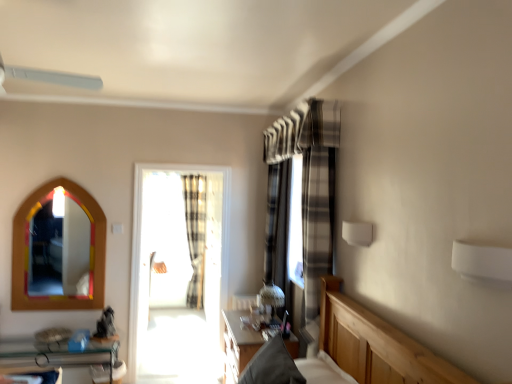
Where is `plaid fabric curtain at center, acting as the 1th curtain starting from the front`? This screenshot has width=512, height=384. plaid fabric curtain at center, acting as the 1th curtain starting from the front is located at coordinates (318, 195).

The height and width of the screenshot is (384, 512). What are the coordinates of `translucent glass window at center` in the screenshot? It's located at (175, 248).

What is the approximate width of translucent glass window at center?

The width of translucent glass window at center is 7.14 inches.

What do you see at coordinates (238, 345) in the screenshot? I see `wooden table at center` at bounding box center [238, 345].

You are a GUI agent. You are given a task and a screenshot of the screen. Output one action in this format:
    pyautogui.click(x=<x>, y=<y>)
    Task: Click on the wooden table at center
    The image size is (512, 384).
    Given the screenshot: What is the action you would take?
    pyautogui.click(x=238, y=345)

You are a GUI agent. You are given a task and a screenshot of the screen. Output one action in this format:
    pyautogui.click(x=<x>, y=<y>)
    Task: Click on the clear glass shelf at lower left
    
    Given the screenshot: What is the action you would take?
    pyautogui.click(x=55, y=353)

Could you tell me if white plastic fan at upper left is facing multicolored wooden mirror at left?

No, white plastic fan at upper left does not turn towards multicolored wooden mirror at left.

Is multicolored wooden mirror at left inside white plastic fan at upper left?

That's incorrect, multicolored wooden mirror at left is not inside white plastic fan at upper left.

Considering the sizes of objects white plastic fan at upper left and multicolored wooden mirror at left in the image provided, who is taller, white plastic fan at upper left or multicolored wooden mirror at left?

With more height is multicolored wooden mirror at left.

Which of these two, wooden table at center or plaid fabric curtain at center, the first curtain in the right-to-left sequence, is smaller?

wooden table at center.

Is wooden table at center to the left or to the right of plaid fabric curtain at center, which is counted as the 2th curtain, starting from the back, in the image?

From the image, it's evident that wooden table at center is to the left of plaid fabric curtain at center, which is counted as the 2th curtain, starting from the back.

Is wooden table at center positioned far away from plaid fabric curtain at center, which is counted as the second curtain, starting from the left?

No.

Is wooden table at center closer to the viewer compared to plaid fabric curtain at center, which is counted as the 2th curtain, starting from the back?

Yes, it is in front of plaid fabric curtain at center, which is counted as the 2th curtain, starting from the back.

Considering the sizes of objects translucent glass window at center and clear glass shelf at lower left in the image provided, who is thinner, translucent glass window at center or clear glass shelf at lower left?

With smaller width is translucent glass window at center.

Can clear glass shelf at lower left be found inside translucent glass window at center?

That's incorrect, clear glass shelf at lower left is not inside translucent glass window at center.

Consider the image. Does translucent glass window at center lie in front of clear glass shelf at lower left?

No, translucent glass window at center is behind clear glass shelf at lower left.

Which is in front, point (207, 232) or point (108, 366)?

The point (108, 366) is in front.

From a real-world perspective, is plaid fabric curtain at center, acting as the 1th curtain starting from the front, located beneath plaid fabric curtain at center, the 1th curtain viewed from the back?

No.

Can you tell me how much plaid fabric curtain at center, acting as the 1th curtain starting from the front, and plaid fabric curtain at center, which ranks as the second curtain in right-to-left order, differ in facing direction?

The angular difference between plaid fabric curtain at center, acting as the 1th curtain starting from the front, and plaid fabric curtain at center, which ranks as the second curtain in right-to-left order, is 87.2 degrees.

Is the depth of plaid fabric curtain at center, which is counted as the 2th curtain, starting from the back, greater than that of plaid fabric curtain at center, which ranks as the second curtain in right-to-left order?

No, it is not.

What are the coordinates of `curtain below the plaid fabric curtain at center, which is counted as the second curtain, starting from the left (from the image's perspective)` in the screenshot? It's located at (195, 234).

Are clear glass shelf at lower left and translucent glass window at center far apart?

clear glass shelf at lower left is far away from translucent glass window at center.

Considering the relative positions of clear glass shelf at lower left and translucent glass window at center in the image provided, is clear glass shelf at lower left to the right of translucent glass window at center from the viewer's perspective?

No.

Which object is further away from the camera taking this photo, clear glass shelf at lower left or translucent glass window at center?

translucent glass window at center is behind.

Is white plastic fan at upper left facing away from plaid fabric curtain at center, arranged as the first curtain when viewed from the left?

white plastic fan at upper left does not have its back to plaid fabric curtain at center, arranged as the first curtain when viewed from the left.

Can you confirm if white plastic fan at upper left is thinner than plaid fabric curtain at center, the 2th curtain viewed from the front?

No.

Is white plastic fan at upper left next to plaid fabric curtain at center, the 1th curtain viewed from the back, and touching it?

There is a gap between white plastic fan at upper left and plaid fabric curtain at center, the 1th curtain viewed from the back.

In the scene shown: Can you tell me how much white plastic fan at upper left and plaid fabric curtain at center, which ranks as the second curtain in right-to-left order, differ in facing direction?

0.824 degrees.

Which is in front, point (101, 83) or point (224, 335)?

The point (101, 83) is closer to the camera.

Considering the positions of objects white plastic fan at upper left and wooden table at center in the image provided, who is more to the left, white plastic fan at upper left or wooden table at center?

white plastic fan at upper left is more to the left.

Who is shorter, white plastic fan at upper left or wooden table at center?

Standing shorter between the two is white plastic fan at upper left.

Identify the location of mirror that is behind the white plastic fan at upper left. (59, 251).

Identify the location of table that is on the left side of plaid fabric curtain at center, which is counted as the 2th curtain, starting from the back. The image size is (512, 384). (238, 345).

Estimate the real-world distances between objects in this image. Which object is further from plaid fabric curtain at center, which ranks as the second curtain in right-to-left order, white plastic fan at upper left or clear glass shelf at lower left?

The object further to plaid fabric curtain at center, which ranks as the second curtain in right-to-left order, is white plastic fan at upper left.

Based on their spatial positions, is wooden table at center or plaid fabric curtain at center, the first curtain in the right-to-left sequence, further from translucent glass window at center?

plaid fabric curtain at center, the first curtain in the right-to-left sequence.

Consider the image. Which object lies further to the anchor point plaid fabric curtain at center, which is counted as the second curtain, starting from the left, translucent glass window at center or wooden table at center?

translucent glass window at center.

Estimate the real-world distances between objects in this image. Which object is further from white plastic fan at upper left, plaid fabric curtain at center, which is counted as the second curtain, starting from the left, or plaid fabric curtain at center, the 2th curtain viewed from the front?

plaid fabric curtain at center, the 2th curtain viewed from the front, is further to white plastic fan at upper left.

Looking at the image, which one is located closer to plaid fabric curtain at center, the 2th curtain viewed from the front, clear glass shelf at lower left or white plastic fan at upper left?

Based on the image, clear glass shelf at lower left appears to be nearer to plaid fabric curtain at center, the 2th curtain viewed from the front.

In the scene shown: Which object lies nearer to the anchor point plaid fabric curtain at center, the 1th curtain viewed from the back, wooden table at center or plaid fabric curtain at center, the first curtain in the right-to-left sequence?

The object closer to plaid fabric curtain at center, the 1th curtain viewed from the back, is wooden table at center.

From the image, which object appears to be farther from wooden table at center, plaid fabric curtain at center, which ranks as the second curtain in right-to-left order, or plaid fabric curtain at center, acting as the 1th curtain starting from the front?

Based on the image, plaid fabric curtain at center, which ranks as the second curtain in right-to-left order, appears to be further to wooden table at center.

Which object lies further to the anchor point multicolored wooden mirror at left, translucent glass window at center or white plastic fan at upper left?

white plastic fan at upper left is positioned further to the anchor multicolored wooden mirror at left.

Where is `table between white plastic fan at upper left and plaid fabric curtain at center, which is counted as the 2th curtain, starting from the back, in the horizontal direction`? Image resolution: width=512 pixels, height=384 pixels. table between white plastic fan at upper left and plaid fabric curtain at center, which is counted as the 2th curtain, starting from the back, in the horizontal direction is located at coordinates (238, 345).

This screenshot has width=512, height=384. I want to click on mirror located between white plastic fan at upper left and plaid fabric curtain at center, which is counted as the 2th curtain, starting from the back, in the left-right direction, so click(x=59, y=251).

You are a GUI agent. You are given a task and a screenshot of the screen. Output one action in this format:
    pyautogui.click(x=<x>, y=<y>)
    Task: Click on the curtain located between white plastic fan at upper left and plaid fabric curtain at center, the 1th curtain viewed from the back, in the depth direction
    The width and height of the screenshot is (512, 384).
    Given the screenshot: What is the action you would take?
    pyautogui.click(x=318, y=195)

You are a GUI agent. You are given a task and a screenshot of the screen. Output one action in this format:
    pyautogui.click(x=<x>, y=<y>)
    Task: Click on the table between clear glass shelf at lower left and plaid fabric curtain at center, which is counted as the second curtain, starting from the left, from left to right
    The width and height of the screenshot is (512, 384).
    Given the screenshot: What is the action you would take?
    pyautogui.click(x=238, y=345)